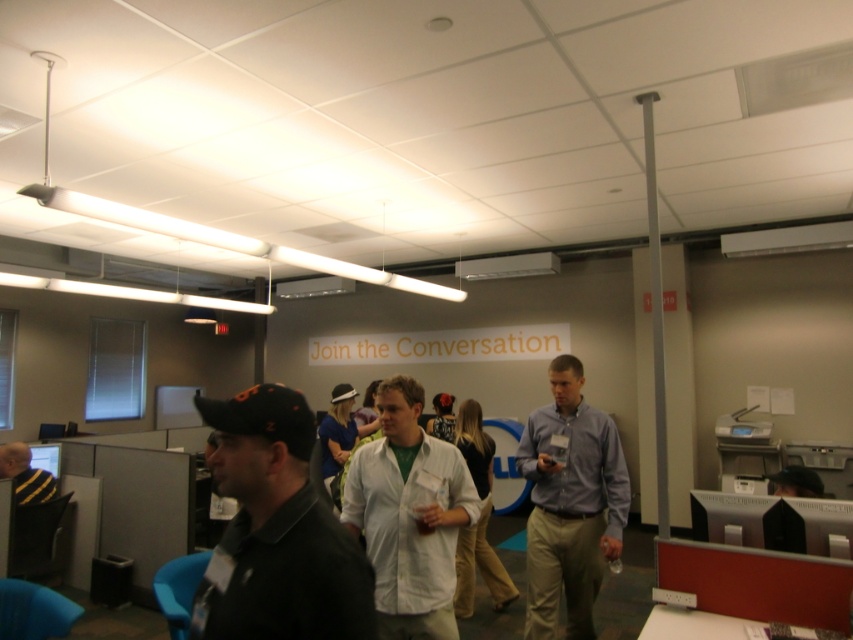
Question: Which object is farther from the camera taking this photo?

Choices:
 (A) black matte cap at left
 (B) matte black cap at center
 (C) striped sweater at lower left
 (D) white matte shirt at center

Answer: (B)

Question: Can you confirm if matte black cap at center is wider than matte purple shirt at center?

Choices:
 (A) no
 (B) yes

Answer: (A)

Question: In this image, where is black matte cap at left located relative to white cotton shirt at center?

Choices:
 (A) right
 (B) left

Answer: (B)

Question: Which of these objects is positioned closest to the light blue shirt at center?

Choices:
 (A) matte black cap at center
 (B) white matte shirt at center

Answer: (B)

Question: Which of these objects is positioned farthest from the striped sweater at lower left?

Choices:
 (A) light blue shirt at center
 (B) white cotton shirt at center

Answer: (A)

Question: Is black matte cap at left below white cotton shirt at center?

Choices:
 (A) no
 (B) yes

Answer: (A)